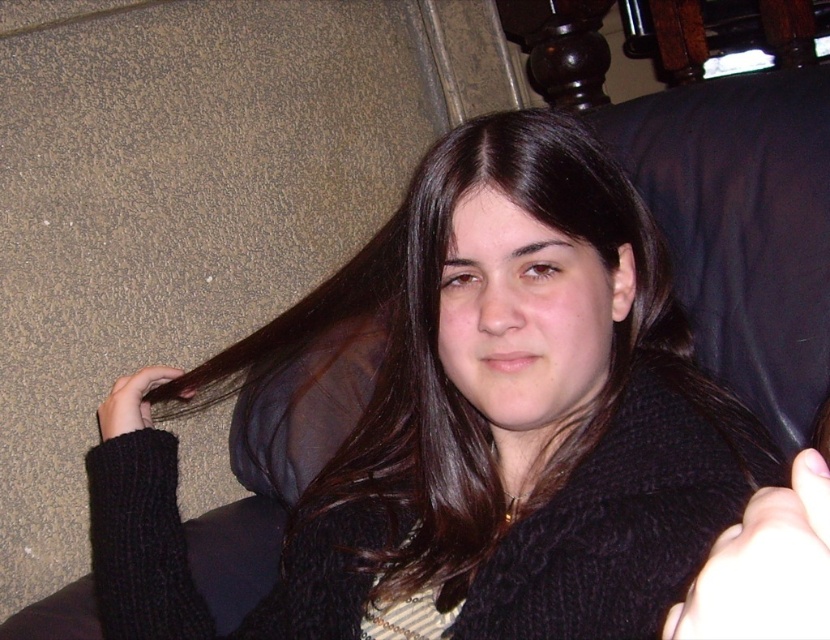
Does dark brown hair at center appear on the right side of white matte hand at lower right?

In fact, dark brown hair at center is to the left of white matte hand at lower right.

In the scene shown: Who is more distant from viewer, (201, 632) or (806, 602)?

Positioned behind is point (201, 632).

The width and height of the screenshot is (830, 640). What are the coordinates of `dark brown hair at center` in the screenshot? It's located at 511,410.

Who is more distant from viewer, (721, 540) or (125, 388)?

Point (125, 388)

Which is more to the right, white matte hand at lower right or black knitted hand at upper left?

Positioned to the right is white matte hand at lower right.

This screenshot has width=830, height=640. Describe the element at coordinates (765, 564) in the screenshot. I see `white matte hand at lower right` at that location.

At what (x,y) coordinates should I click in order to perform the action: click on white matte hand at lower right. Please return your answer as a coordinate pair (x, y). The width and height of the screenshot is (830, 640). Looking at the image, I should click on (765, 564).

Is dark brown hair at center wider than black knitted hand at upper left?

Indeed, dark brown hair at center has a greater width compared to black knitted hand at upper left.

Can you confirm if dark brown hair at center is shorter than black knitted hand at upper left?

In fact, dark brown hair at center may be taller than black knitted hand at upper left.

Identify the location of dark brown hair at center. [511, 410].